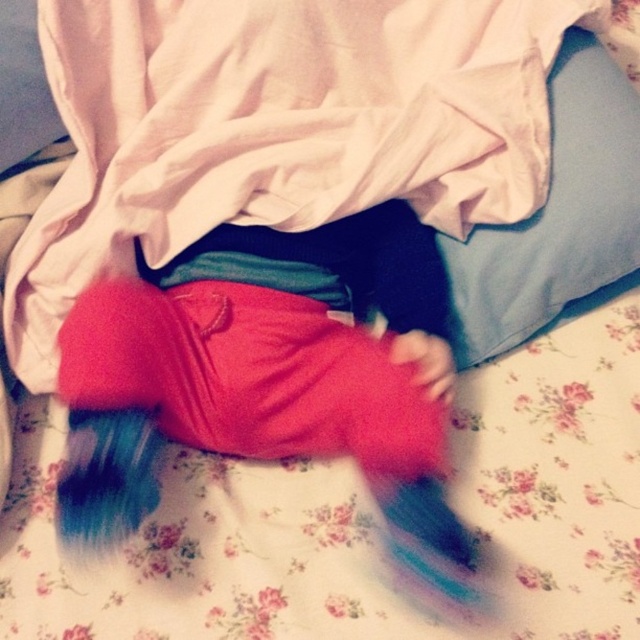
Question: Where is fluffy red pants at center located in relation to light blue fabric pillow at upper right in the image?

Choices:
 (A) left
 (B) right

Answer: (A)

Question: Which point is closer to the camera?

Choices:
 (A) fluffy red pants at center
 (B) light blue fabric pillow at upper right

Answer: (A)

Question: Can you confirm if fluffy red pants at center is positioned above light blue fabric pillow at upper right?

Choices:
 (A) no
 (B) yes

Answer: (A)

Question: Does fluffy red pants at center have a smaller size compared to light blue fabric pillow at upper right?

Choices:
 (A) yes
 (B) no

Answer: (B)

Question: Which object appears farthest from the camera in this image?

Choices:
 (A) light blue fabric pillow at upper right
 (B) fluffy red pants at center

Answer: (A)